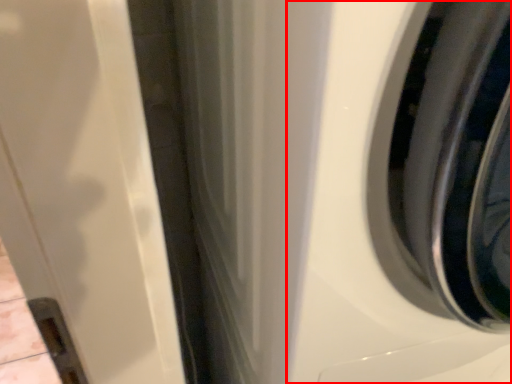
Question: Observing the image, what is the correct spatial positioning of washing machine (annotated by the red box) in reference to wheel?

Choices:
 (A) left
 (B) right

Answer: (A)